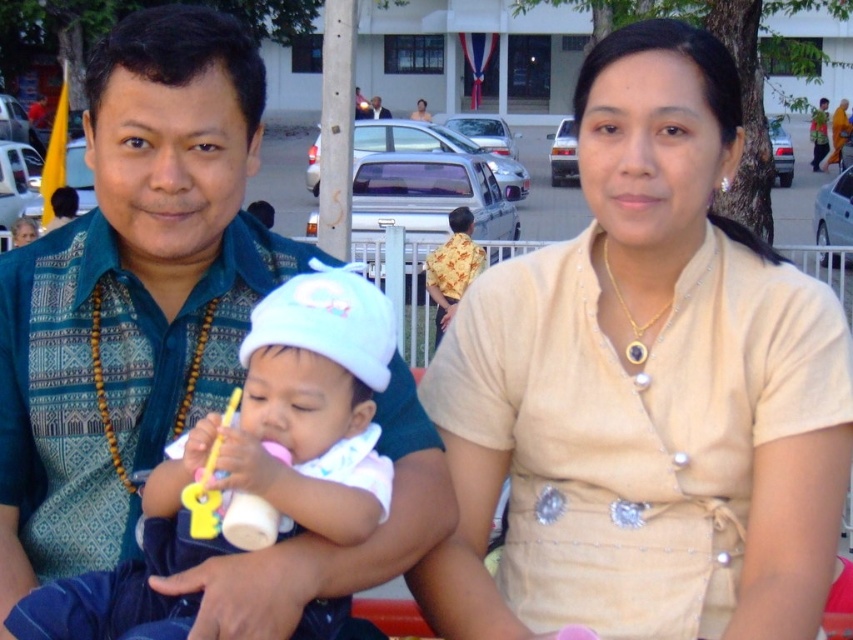
Question: Is blue patterned shirt at left positioned behind yellow plastic toy at center?

Choices:
 (A) no
 (B) yes

Answer: (B)

Question: Which point is closer to the camera?

Choices:
 (A) blue patterned shirt at left
 (B) yellow plastic toy at center
 (C) beige fabric blouse at center

Answer: (B)

Question: Can you confirm if beige fabric blouse at center is thinner than blue patterned shirt at left?

Choices:
 (A) no
 (B) yes

Answer: (A)

Question: Which of these objects is positioned farthest from the blue patterned shirt at left?

Choices:
 (A) beige fabric blouse at center
 (B) yellow plastic toy at center

Answer: (A)

Question: Is the position of beige fabric blouse at center less distant than that of yellow plastic toy at center?

Choices:
 (A) no
 (B) yes

Answer: (A)

Question: Which point appears closest to the camera in this image?

Choices:
 (A) (61, 502)
 (B) (199, 497)
 (C) (633, 150)

Answer: (B)